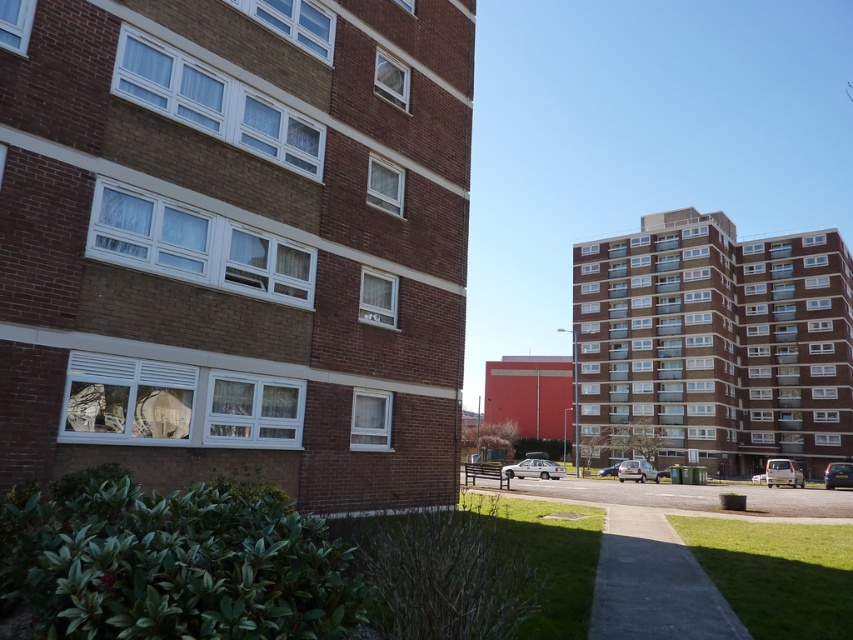
You are standing at the camera position in the image and want to reach a point that is 118.22 feet away. Is the point you are aiming for the point at coordinates point (786, 472)?

Yes, the point at coordinates point (786, 472) is 118.22 feet away from the camera, so it is the point you are aiming for.

You are standing at the viewpoint of the image and want to place a small flag at both the point marked as point (531, 467) and the point marked as point (656, 477). Which point requires you to walk further away from your current position to place the flag?

Point (656, 477) requires walking further away from your current position because it is farther from the camera compared to point (531, 467).

You are a delivery person trying to park your van in the urban residential area shown. You see a silver metallic sedan at center and a silver metallic car at center. Which vehicle should you avoid parking next to if you want to leave more space for other vehicles?

You should avoid parking next to the silver metallic sedan at center because it is larger in size than the silver metallic car at center, so leaving space next to the larger vehicle would allow more room for others.